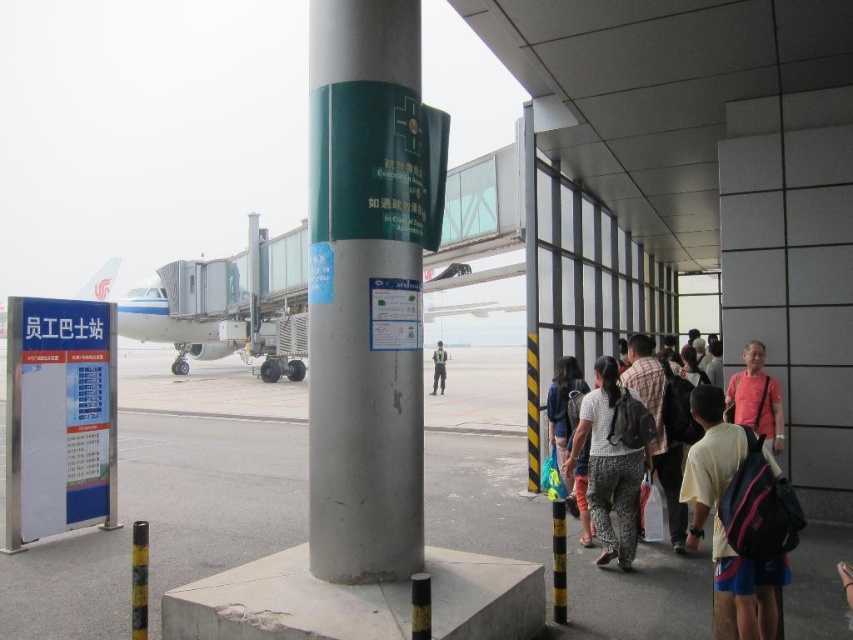
You are a traveler standing at the airport terminal and see the silver metallic pole at center and the light brown backpack at center. Which object is taller?

The silver metallic pole at center is taller than the light brown backpack at center.

You are a traveler standing in the airport terminal. You see a silver metallic pole at center and a light yellow fabric shirt at lower right. Which object is closer to your left side?

The silver metallic pole at center is positioned on the left side of light yellow fabric shirt at lower right, so it is closer to your left side.